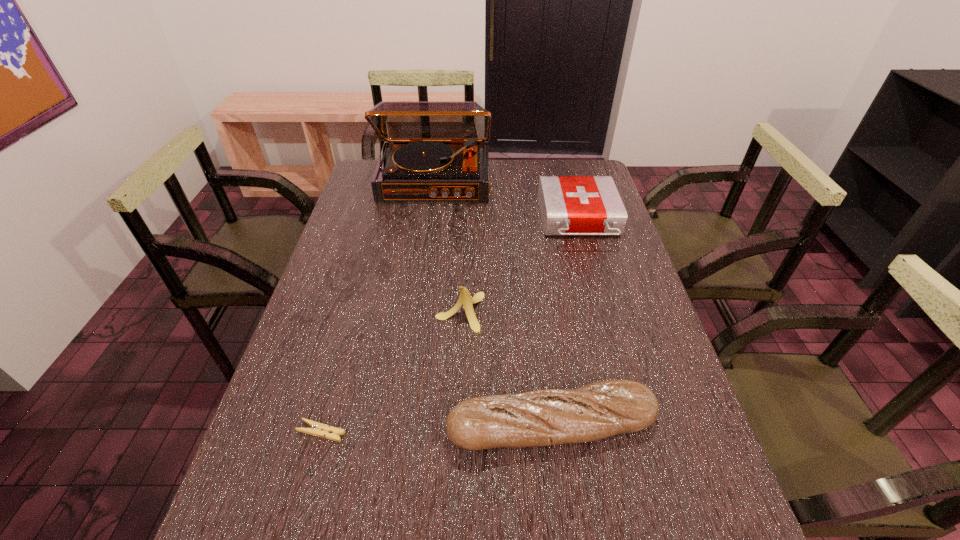
Where is `vacant area situated on the front of the shortest object`? vacant area situated on the front of the shortest object is located at coordinates (297, 521).

Where is `object present at the far edge`? Image resolution: width=960 pixels, height=540 pixels. object present at the far edge is located at coordinates (434, 150).

You are a GUI agent. You are given a task and a screenshot of the screen. Output one action in this format:
    pyautogui.click(x=<x>, y=<y>)
    Task: Click on the record player present at the left edge
    
    Given the screenshot: What is the action you would take?
    pyautogui.click(x=434, y=150)

Locate an element on the screen. clothespin that is at the left edge is located at coordinates (318, 429).

Where is `baguet located in the right edge section of the desktop`? baguet located in the right edge section of the desktop is located at coordinates [598, 410].

This screenshot has height=540, width=960. I want to click on the first-aid kit that is at the right edge, so click(570, 205).

Identify the location of object that is positioned at the far left corner. (434, 150).

Find the location of a particular element. vacant area at the far edge is located at coordinates (532, 174).

This screenshot has width=960, height=540. In order to click on free region at the left edge of the desktop in this screenshot , I will do `click(239, 492)`.

In the image, there is a desktop. Where is `free space at the right edge`? This screenshot has height=540, width=960. free space at the right edge is located at coordinates (614, 274).